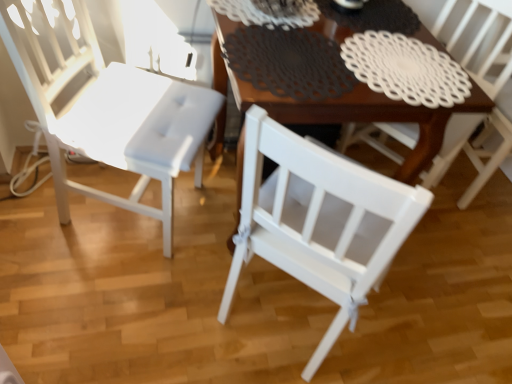
Locate an element on the screen. This screenshot has height=384, width=512. wooden table at center is located at coordinates (350, 108).

This screenshot has width=512, height=384. What do you see at coordinates (113, 115) in the screenshot? I see `white matte chair at left, marked as the 1th chair in a left-to-right arrangement` at bounding box center [113, 115].

Locate an element on the screen. This screenshot has width=512, height=384. wooden table at center is located at coordinates (350, 108).

Can you tell me how much wooden table at center and white matte chair at center, which is the 2th chair from left to right, differ in facing direction?

53.3 degrees separate the facing orientations of wooden table at center and white matte chair at center, which is the 2th chair from left to right.

Considering the positions of objects wooden table at center and white matte chair at center, which is the 2th chair from left to right, in the image provided, who is more to the right, wooden table at center or white matte chair at center, which is the 2th chair from left to right,?

Positioned to the right is white matte chair at center, which is the 2th chair from left to right.

Who is smaller, wooden table at center or white matte chair at center, which is the 2th chair from left to right?

With smaller size is white matte chair at center, which is the 2th chair from left to right.

Is wooden table at center outside of white matte chair at center, which is the 2th chair from left to right?

wooden table at center is positioned outside white matte chair at center, which is the 2th chair from left to right.

Considering the sizes of white matte chair at left, the 2th chair when ordered from right to left, and white matte chair at center, which is the 2th chair from left to right, in the image, is white matte chair at left, the 2th chair when ordered from right to left, taller or shorter than white matte chair at center, which is the 2th chair from left to right,?

In the image, white matte chair at left, the 2th chair when ordered from right to left, appears to be shorter than white matte chair at center, which is the 2th chair from left to right.

Considering the relative positions of white matte chair at left, marked as the 1th chair in a left-to-right arrangement, and white matte chair at center, the first chair when ordered from right to left, in the image provided, is white matte chair at left, marked as the 1th chair in a left-to-right arrangement, to the left of white matte chair at center, the first chair when ordered from right to left, from the viewer's perspective?

Yes.

Considering the relative sizes of white matte chair at left, marked as the 1th chair in a left-to-right arrangement, and white matte chair at center, which is the 2th chair from left to right, in the image provided, is white matte chair at left, marked as the 1th chair in a left-to-right arrangement, bigger than white matte chair at center, which is the 2th chair from left to right,?

No, white matte chair at left, marked as the 1th chair in a left-to-right arrangement, is not bigger than white matte chair at center, which is the 2th chair from left to right.

Find the location of a particular element. chair behind the white matte chair at left, marked as the 1th chair in a left-to-right arrangement is located at coordinates (477, 38).

Considering the relative sizes of white matte chair at center, the first chair when ordered from right to left, and white matte chair at left, marked as the 1th chair in a left-to-right arrangement, in the image provided, is white matte chair at center, the first chair when ordered from right to left, smaller than white matte chair at left, marked as the 1th chair in a left-to-right arrangement,?

Actually, white matte chair at center, the first chair when ordered from right to left, might be larger than white matte chair at left, marked as the 1th chair in a left-to-right arrangement.

Does white matte chair at center, the first chair when ordered from right to left, have a greater width compared to white matte chair at left, marked as the 1th chair in a left-to-right arrangement?

Indeed, white matte chair at center, the first chair when ordered from right to left, has a greater width compared to white matte chair at left, marked as the 1th chair in a left-to-right arrangement.

How many degrees apart are the facing directions of white matte chair at center, the first chair when ordered from right to left, and white matte chair at left, the 2th chair when ordered from right to left?

They differ by 118 degrees in their facing directions.

Between white matte chair at center, the first chair when ordered from right to left, and white matte chair at left, marked as the 1th chair in a left-to-right arrangement, which one has more height?

Standing taller between the two is white matte chair at center, the first chair when ordered from right to left.

Which is in front, point (278, 106) or point (114, 122)?

The point (278, 106) is closer to the camera.

Is wooden table at center oriented towards white matte chair at left, the 2th chair when ordered from right to left?

No.

Locate an element on the screen. table behind the white matte chair at left, the 2th chair when ordered from right to left is located at coordinates (350, 108).

Would you say wooden table at center is outside white matte chair at left, the 2th chair when ordered from right to left?

wooden table at center is positioned outside white matte chair at left, the 2th chair when ordered from right to left.

From the image's perspective, would you say white matte chair at left, marked as the 1th chair in a left-to-right arrangement, is positioned over wooden table at center?

Yes, from the image's perspective, white matte chair at left, marked as the 1th chair in a left-to-right arrangement, is over wooden table at center.

Which is more to the right, white matte chair at left, the 2th chair when ordered from right to left, or wooden table at center?

wooden table at center.

Does white matte chair at left, marked as the 1th chair in a left-to-right arrangement, have a greater height compared to wooden table at center?

Yes.

Considering the sizes of objects white matte chair at left, the 2th chair when ordered from right to left, and wooden table at center in the image provided, who is thinner, white matte chair at left, the 2th chair when ordered from right to left, or wooden table at center?

With smaller width is white matte chair at left, the 2th chair when ordered from right to left.

Based on their positions, is white matte chair at center, which is the 2th chair from left to right, located to the left or right of wooden table at center?

From the image, it's evident that white matte chair at center, which is the 2th chair from left to right, is to the right of wooden table at center.

Looking at this image, from the image's perspective, would you say white matte chair at center, the first chair when ordered from right to left, is shown under wooden table at center?

No, from the image's perspective, white matte chair at center, the first chair when ordered from right to left, is not beneath wooden table at center.

Would you say white matte chair at center, which is the 2th chair from left to right, is inside or outside wooden table at center?

white matte chair at center, which is the 2th chair from left to right, is not inside wooden table at center, it's outside.

Is white matte chair at center, which is the 2th chair from left to right, wider than wooden table at center?

In fact, white matte chair at center, which is the 2th chair from left to right, might be narrower than wooden table at center.

I want to click on chair that is the 2nd object located above the wooden table at center (from the image's perspective), so click(x=477, y=38).

At what (x,y) coordinates should I click in order to perform the action: click on chair on the left of white matte chair at center, the first chair when ordered from right to left. Please return your answer as a coordinate pair (x, y). Looking at the image, I should click on (113, 115).

Considering their positions, is wooden table at center positioned further to white matte chair at center, which is the 2th chair from left to right, than white matte chair at left, marked as the 1th chair in a left-to-right arrangement?

Based on the image, white matte chair at left, marked as the 1th chair in a left-to-right arrangement, appears to be further to white matte chair at center, which is the 2th chair from left to right.

Based on their spatial positions, is white matte chair at left, marked as the 1th chair in a left-to-right arrangement, or wooden table at center further from white matte chair at center, the first chair when ordered from right to left?

Based on the image, white matte chair at left, marked as the 1th chair in a left-to-right arrangement, appears to be further to white matte chair at center, the first chair when ordered from right to left.

In the scene shown: Which object lies nearer to the anchor point white matte chair at left, the 2th chair when ordered from right to left, white matte chair at center, the first chair when ordered from right to left, or wooden table at center?

Result: Among the two, wooden table at center is located nearer to white matte chair at left, the 2th chair when ordered from right to left.

Based on the photo, considering their positions, is wooden table at center positioned further to white matte chair at left, marked as the 1th chair in a left-to-right arrangement, than white matte chair at center, which is the 2th chair from left to right?

white matte chair at center, which is the 2th chair from left to right.

When comparing their distances from wooden table at center, does white matte chair at center, which is the 2th chair from left to right, or white matte chair at left, the 2th chair when ordered from right to left, seem closer?

white matte chair at left, the 2th chair when ordered from right to left.

When comparing their distances from wooden table at center, does white matte chair at left, marked as the 1th chair in a left-to-right arrangement, or white matte chair at center, which is the 2th chair from left to right, seem closer?

white matte chair at left, marked as the 1th chair in a left-to-right arrangement, is closer to wooden table at center.

You are a GUI agent. You are given a task and a screenshot of the screen. Output one action in this format:
    pyautogui.click(x=<x>, y=<y>)
    Task: Click on the table between white matte chair at left, marked as the 1th chair in a left-to-right arrangement, and white matte chair at center, which is the 2th chair from left to right, in the horizontal direction
    This screenshot has width=512, height=384.
    Given the screenshot: What is the action you would take?
    pyautogui.click(x=350, y=108)